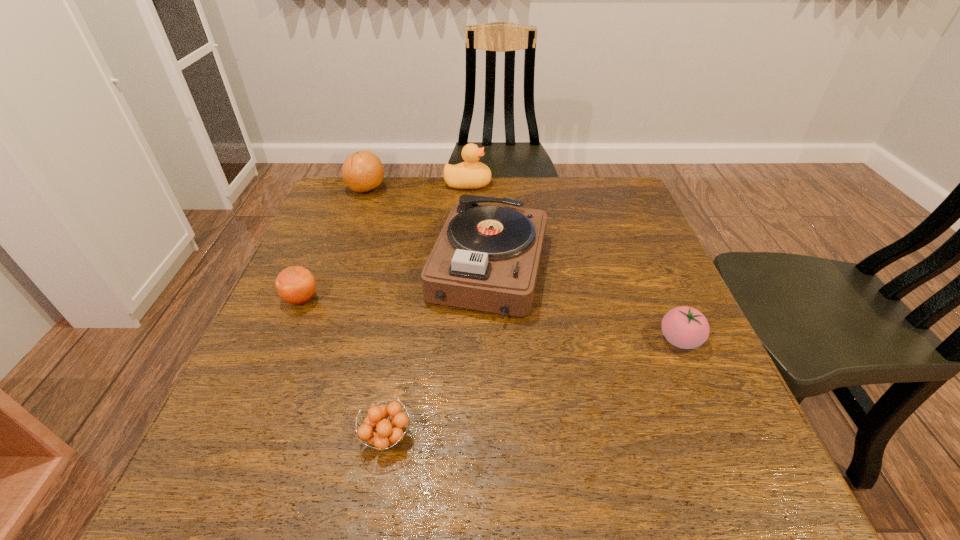
The width and height of the screenshot is (960, 540). I want to click on vacant region that satisfies the following two spatial constraints: 1. on the face of the duck; 2. on the left side of the record player, so click(465, 268).